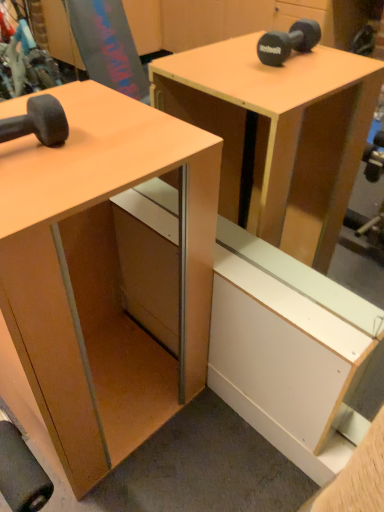
Question: Can you confirm if matte black dumbbell at left is shorter than matte wood desk at left?

Choices:
 (A) no
 (B) yes

Answer: (B)

Question: Is matte black dumbbell at left at the right side of matte wood desk at left?

Choices:
 (A) yes
 (B) no

Answer: (B)

Question: Does matte black dumbbell at left appear on the left side of matte wood desk at left?

Choices:
 (A) yes
 (B) no

Answer: (A)

Question: Is matte black dumbbell at left far from matte wood desk at left?

Choices:
 (A) yes
 (B) no

Answer: (B)

Question: From a real-world perspective, is matte black dumbbell at left physically above matte wood desk at left?

Choices:
 (A) yes
 (B) no

Answer: (A)

Question: From the image's perspective, is matte black dumbbell at left under matte wood desk at left?

Choices:
 (A) yes
 (B) no

Answer: (B)

Question: Does matte wood desk at left appear on the left side of matte black dumbbell at left?

Choices:
 (A) no
 (B) yes

Answer: (A)

Question: Is matte black dumbbell at left at the back of matte wood desk at left?

Choices:
 (A) yes
 (B) no

Answer: (B)

Question: From a real-world perspective, is matte wood desk at left on matte black dumbbell at left?

Choices:
 (A) no
 (B) yes

Answer: (A)

Question: From a real-world perspective, is matte wood desk at left below matte black dumbbell at left?

Choices:
 (A) yes
 (B) no

Answer: (A)

Question: From the image's perspective, does matte wood desk at left appear lower than matte black dumbbell at left?

Choices:
 (A) yes
 (B) no

Answer: (A)

Question: Is matte wood desk at left at the right side of matte black dumbbell at left?

Choices:
 (A) no
 (B) yes

Answer: (B)

Question: Based on their positions, is matte black dumbbell at left located to the left or right of matte wood desk at left?

Choices:
 (A) right
 (B) left

Answer: (B)